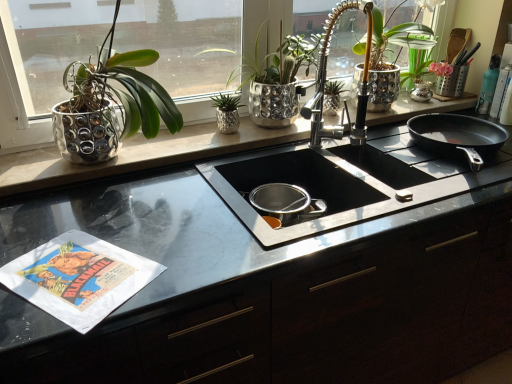
Find the location of `vacant area that lies to the right of green metallic plant at center, which ranks as the third houseplant in right-to-left order`. vacant area that lies to the right of green metallic plant at center, which ranks as the third houseplant in right-to-left order is located at coordinates (268, 132).